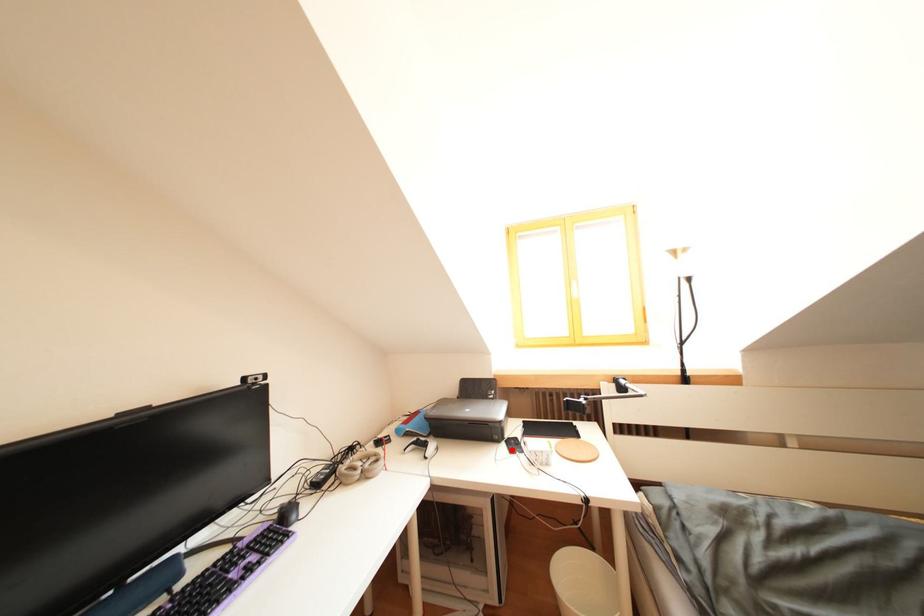
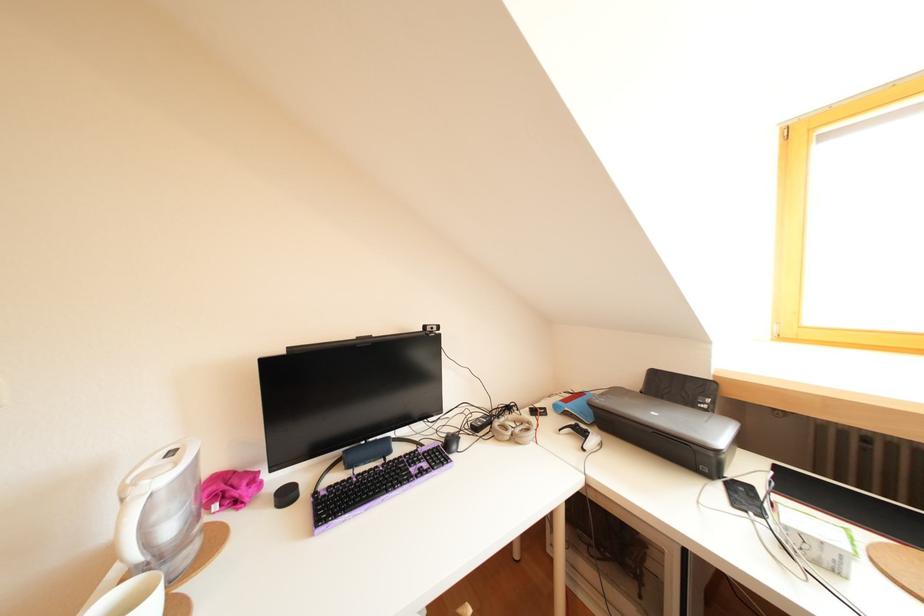
Where in the second image is the point corresponding to the highlighted location from the first image?

(727, 490)